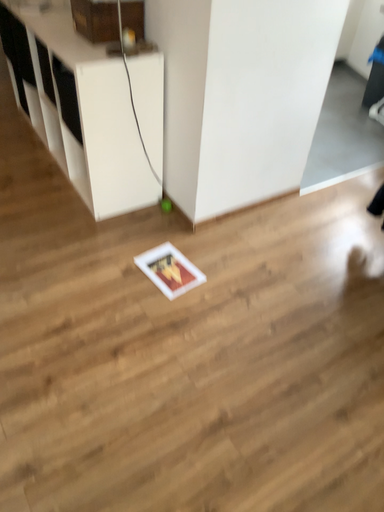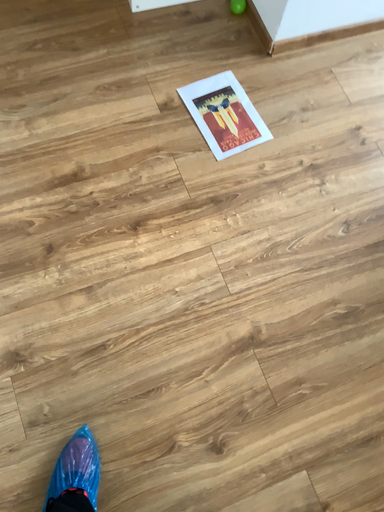
Question: How did the camera likely rotate when shooting the video?

Choices:
 (A) rotated left
 (B) rotated right

Answer: (A)